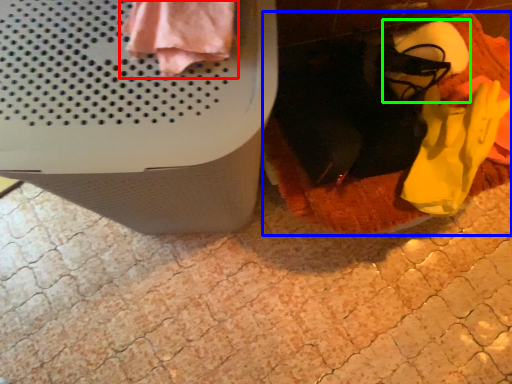
Question: Which object is positioned farthest from clothing (highlighted by a red box)? Select from blanket (highlighted by a blue box) and footwear (highlighted by a green box).

Choices:
 (A) blanket
 (B) footwear

Answer: (B)